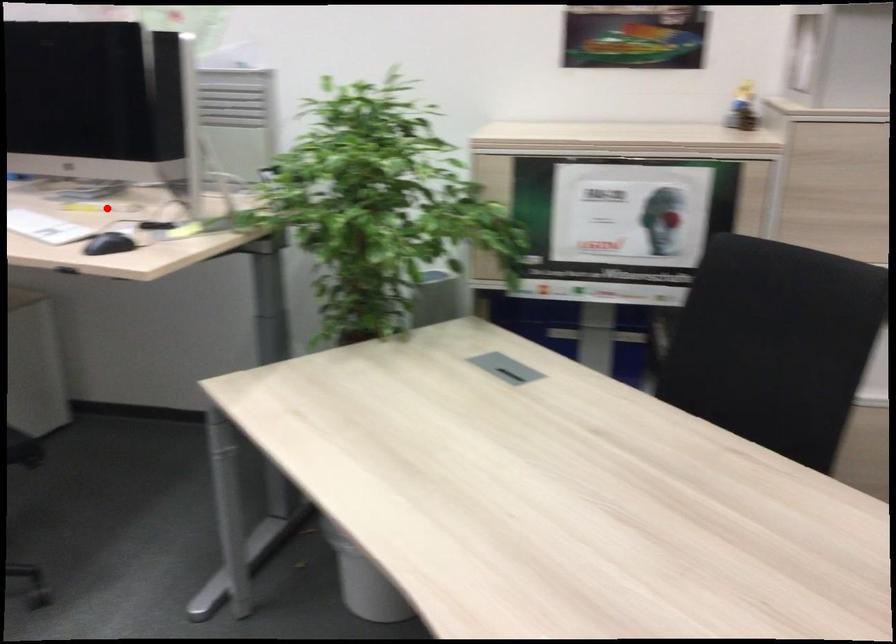
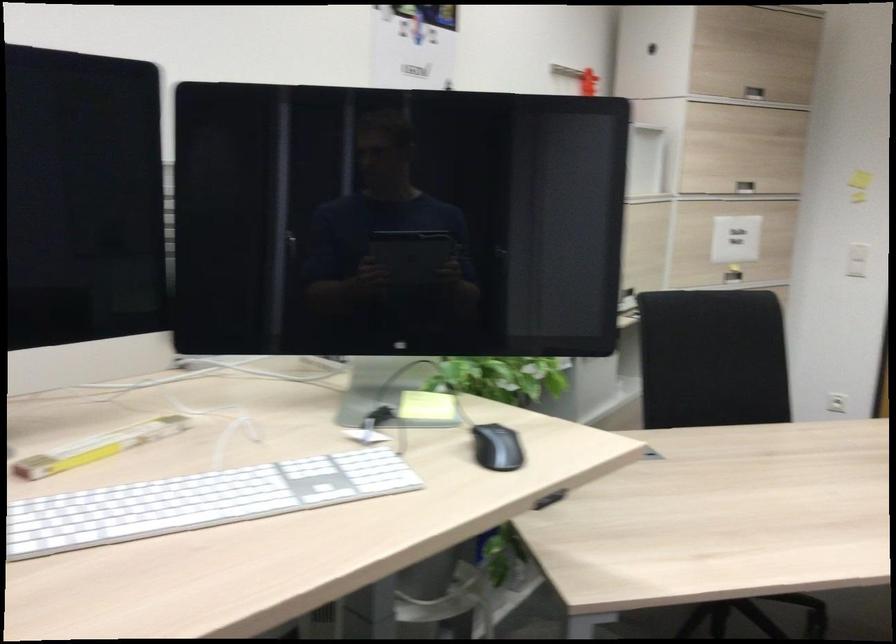
Find the pixel in the second image that matches the highlighted location in the first image.

(98, 447)